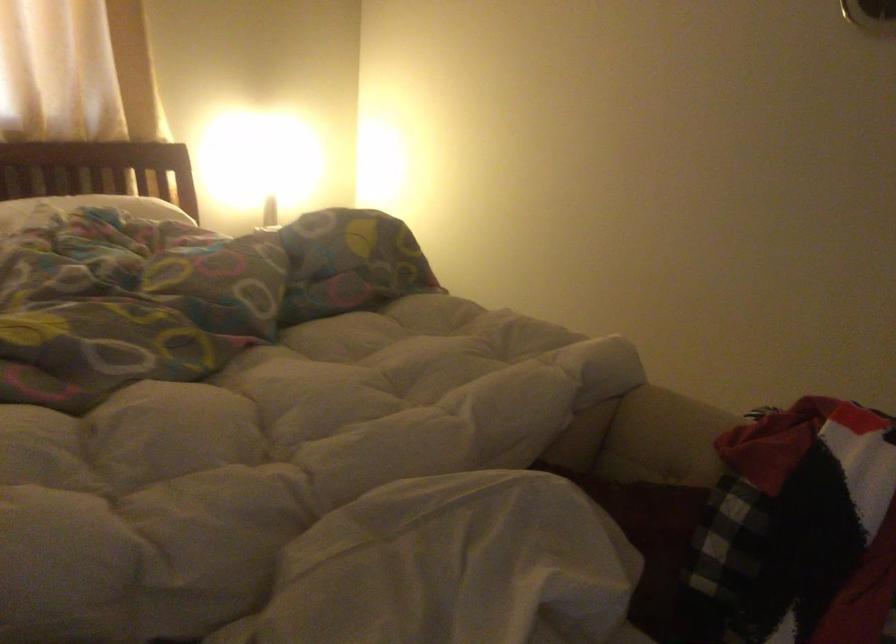
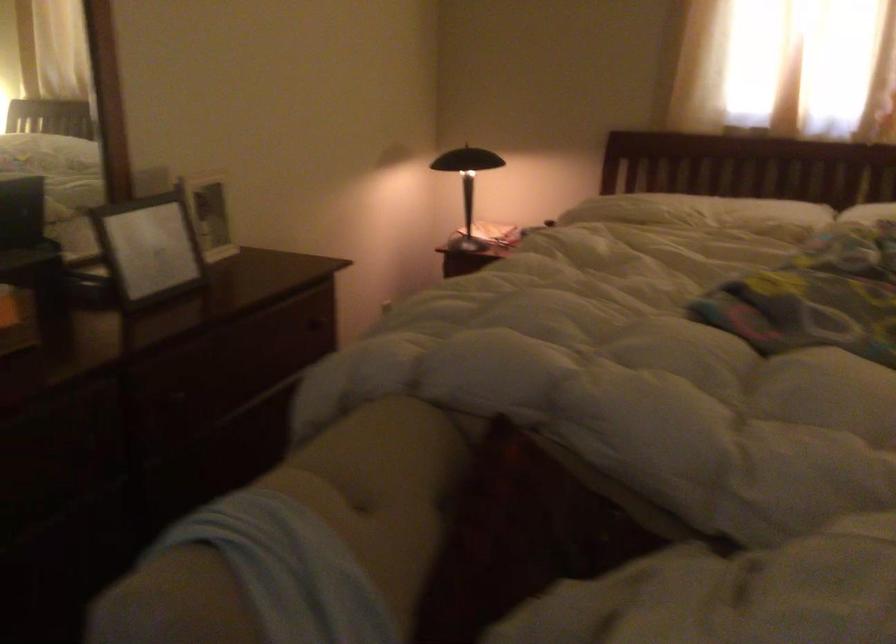
Question: The images are taken continuously from a first-person perspective. In which direction is your viewpoint rotating?

Choices:
 (A) Left
 (B) Right
 (C) Up
 (D) Down

Answer: (A)